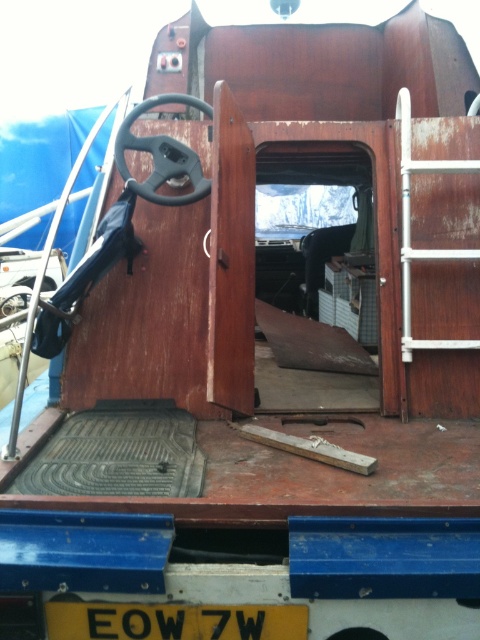
Can you confirm if black rubber steering wheel at center is bigger than matte black steering wheel at center?

Yes.

At what (x,y) coordinates should I click in order to perform the action: click on black rubber steering wheel at center. Please return your answer as a coordinate pair (x, y). The height and width of the screenshot is (640, 480). Looking at the image, I should click on (162, 154).

Can you confirm if yellow matte license plate at bottom is bigger than matte black steering wheel at center?

No, yellow matte license plate at bottom is not bigger than matte black steering wheel at center.

The image size is (480, 640). What do you see at coordinates (173, 621) in the screenshot? I see `yellow matte license plate at bottom` at bounding box center [173, 621].

Which is in front, point (130, 618) or point (6, 300)?

Point (130, 618) is more forward.

Identify the location of yellow matte license plate at bottom. (173, 621).

Between yellow matte license plate at bottom and black rubber steering wheel at center, which one appears on the left side from the viewer's perspective?

black rubber steering wheel at center

Is point (280, 628) behind point (192, 177)?

That is False.

I want to click on yellow matte license plate at bottom, so click(x=173, y=621).